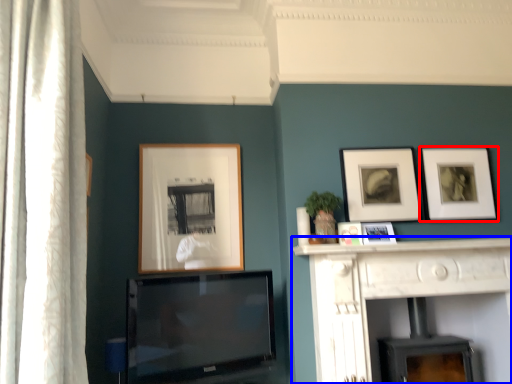
Question: Which object is closer to the camera taking this photo, picture frame (highlighted by a red box) or fireplace (highlighted by a blue box)?

Choices:
 (A) picture frame
 (B) fireplace

Answer: (B)